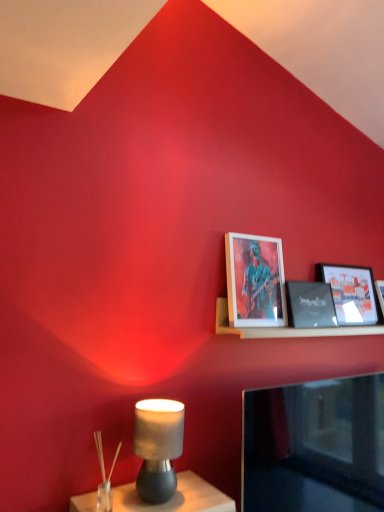
Question: Considering the relative sizes of matte gray lamp at lower left and matte black picture frame at upper right, the 1th picture frame viewed from the right, in the image provided, is matte gray lamp at lower left wider than matte black picture frame at upper right, the 1th picture frame viewed from the right,?

Choices:
 (A) no
 (B) yes

Answer: (B)

Question: Considering the relative sizes of matte gray lamp at lower left and matte black picture frame at upper right, placed as the third picture frame when sorted from left to right, in the image provided, is matte gray lamp at lower left smaller than matte black picture frame at upper right, placed as the third picture frame when sorted from left to right,?

Choices:
 (A) yes
 (B) no

Answer: (A)

Question: Could you tell me if matte gray lamp at lower left is turned towards matte black picture frame at upper right, the 1th picture frame viewed from the right?

Choices:
 (A) yes
 (B) no

Answer: (B)

Question: From the image's perspective, is matte gray lamp at lower left on matte black picture frame at upper right, placed as the third picture frame when sorted from left to right?

Choices:
 (A) no
 (B) yes

Answer: (A)

Question: From a real-world perspective, is matte gray lamp at lower left located beneath matte black picture frame at upper right, the 1th picture frame viewed from the right?

Choices:
 (A) yes
 (B) no

Answer: (A)

Question: From the image's perspective, does matte gray lamp at lower left appear lower than matte black picture frame at upper right, placed as the third picture frame when sorted from left to right?

Choices:
 (A) yes
 (B) no

Answer: (A)

Question: Could wooden shelf at upper right be considered to be inside matte black picture frame at upper right, the second picture frame viewed from the right?

Choices:
 (A) yes
 (B) no

Answer: (B)

Question: Is matte black picture frame at upper right, the second picture frame viewed from the right, outside wooden shelf at upper right?

Choices:
 (A) yes
 (B) no

Answer: (B)

Question: Is the position of matte black picture frame at upper right, acting as the 2th picture frame starting from the left, less distant than that of wooden shelf at upper right?

Choices:
 (A) yes
 (B) no

Answer: (B)

Question: Considering the relative sizes of matte black picture frame at upper right, acting as the 2th picture frame starting from the left, and wooden shelf at upper right in the image provided, is matte black picture frame at upper right, acting as the 2th picture frame starting from the left, wider than wooden shelf at upper right?

Choices:
 (A) no
 (B) yes

Answer: (A)

Question: Is matte black picture frame at upper right, the second picture frame viewed from the right, to the left of wooden shelf at upper right from the viewer's perspective?

Choices:
 (A) yes
 (B) no

Answer: (A)

Question: Would you consider matte black picture frame at upper right, acting as the 2th picture frame starting from the left, to be distant from wooden shelf at upper right?

Choices:
 (A) no
 (B) yes

Answer: (A)

Question: Is matte gray lamp at lower left to the left of matte black picture frame at upper right, acting as the 2th picture frame starting from the left, from the viewer's perspective?

Choices:
 (A) yes
 (B) no

Answer: (A)